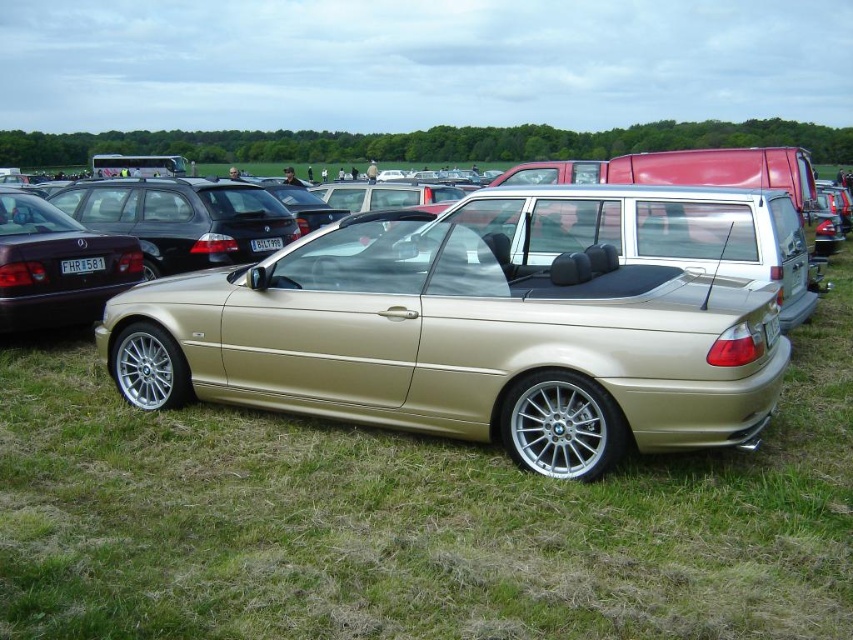
Is silver metallic rim at lower center to the left of black plastic license plate at center from the viewer's perspective?

In fact, silver metallic rim at lower center is to the right of black plastic license plate at center.

Does point (519, 432) come in front of point (91, 260)?

Yes.

Find the location of `silver metallic rim at lower center`. silver metallic rim at lower center is located at coordinates (561, 426).

From the picture: Can you confirm if silver metallic rim at lower center is positioned to the left of white plastic license plate at center?

In fact, silver metallic rim at lower center is to the right of white plastic license plate at center.

Who is taller, silver metallic rim at lower center or white plastic license plate at center?

With more height is silver metallic rim at lower center.

Is point (538, 378) closer to viewer compared to point (276, 243)?

Yes, point (538, 378) is closer to viewer.

Where is `silver metallic rim at lower center`? The width and height of the screenshot is (853, 640). silver metallic rim at lower center is located at coordinates (561, 426).

Between silver metallic rim at lower left and black plastic license plate at center, which one has less height?

black plastic license plate at center is shorter.

Between point (125, 396) and point (73, 259), which one is positioned in front?

Point (125, 396) is more forward.

Who is more distant from viewer, (163, 384) or (74, 262)?

The point (74, 262) is behind.

Image resolution: width=853 pixels, height=640 pixels. Find the location of `silver metallic rim at lower left`. silver metallic rim at lower left is located at coordinates (149, 368).